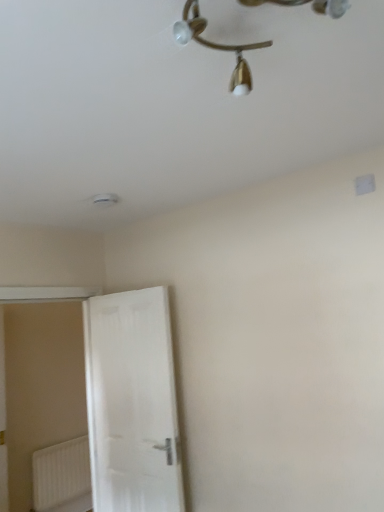
Question: Is white plastic radiator at lower left facing away from white matte door at left?

Choices:
 (A) no
 (B) yes

Answer: (A)

Question: Is white plastic radiator at lower left shorter than white matte door at left?

Choices:
 (A) yes
 (B) no

Answer: (A)

Question: Does white plastic radiator at lower left turn towards white matte door at left?

Choices:
 (A) no
 (B) yes

Answer: (B)

Question: Would you consider white plastic radiator at lower left to be distant from white matte door at left?

Choices:
 (A) no
 (B) yes

Answer: (B)

Question: Does white plastic radiator at lower left appear on the left side of white matte door at left?

Choices:
 (A) no
 (B) yes

Answer: (B)

Question: Considering the relative sizes of white plastic radiator at lower left and white matte door at left in the image provided, is white plastic radiator at lower left wider than white matte door at left?

Choices:
 (A) no
 (B) yes

Answer: (A)

Question: Is gold metallic chandelier at upper center taller than white matte door at left?

Choices:
 (A) no
 (B) yes

Answer: (A)

Question: Is gold metallic chandelier at upper center thinner than white matte door at left?

Choices:
 (A) yes
 (B) no

Answer: (B)

Question: Is gold metallic chandelier at upper center placed right next to white matte door at left?

Choices:
 (A) no
 (B) yes

Answer: (A)

Question: From the image's perspective, would you say gold metallic chandelier at upper center is shown under white matte door at left?

Choices:
 (A) yes
 (B) no

Answer: (B)

Question: From the image's perspective, is gold metallic chandelier at upper center located above white matte door at left?

Choices:
 (A) yes
 (B) no

Answer: (A)

Question: Does gold metallic chandelier at upper center have a smaller size compared to white matte door at left?

Choices:
 (A) no
 (B) yes

Answer: (B)

Question: Is white matte door at left aimed at gold metallic chandelier at upper center?

Choices:
 (A) yes
 (B) no

Answer: (B)